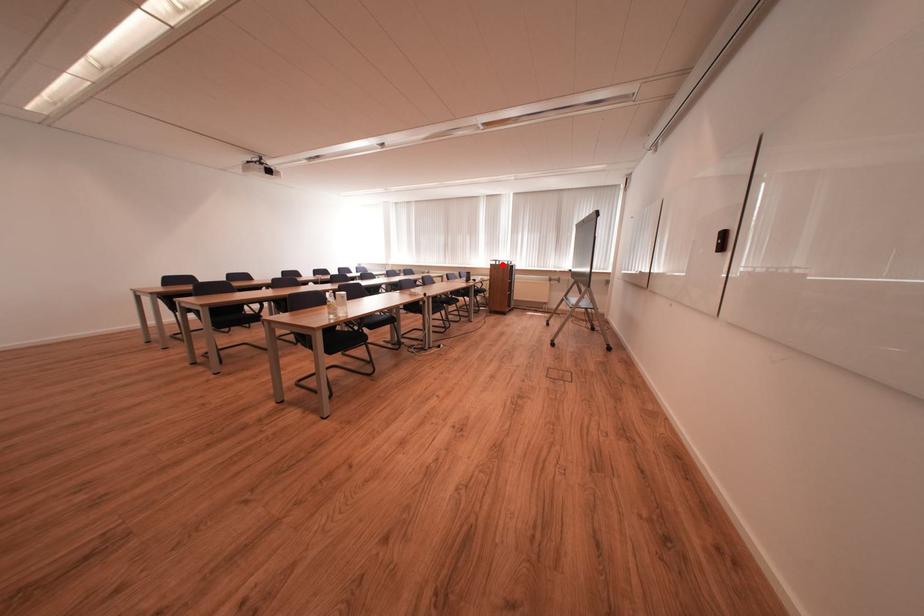
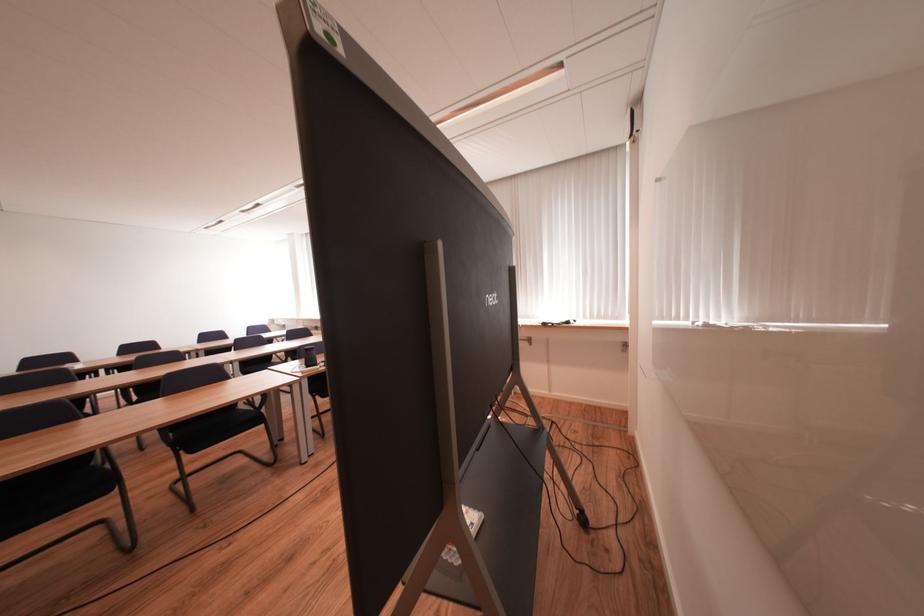
Question: I am providing you with two images of the same scene from different viewpoints. A red point is marked on the first image. Is the red point's position out of view in image 2?

Choices:
 (A) Yes
 (B) No

Answer: (A)